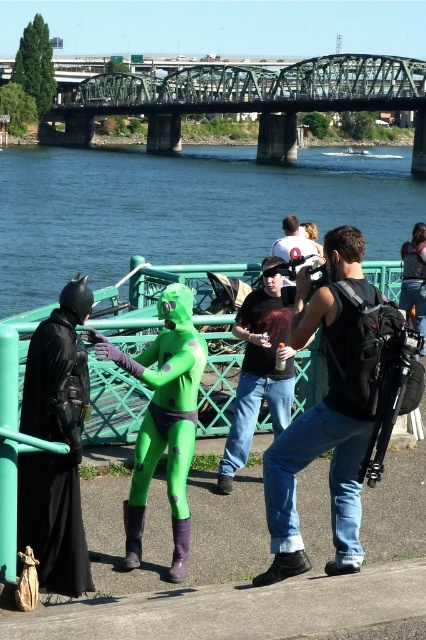
Question: Which object is closer to the camera taking this photo?

Choices:
 (A) white cotton t-shirt at center
 (B) matte black t-shirt at center

Answer: (A)

Question: Observing the image, what is the correct spatial positioning of green painted steel bridge at upper center in reference to black matte cape at left?

Choices:
 (A) above
 (B) below

Answer: (A)

Question: Among these objects, which one is nearest to the camera?

Choices:
 (A) green spandex suit at center
 (B) blue water at center

Answer: (A)

Question: Does denim jeans at center appear under black matte cape at left?

Choices:
 (A) yes
 (B) no

Answer: (B)

Question: Is denim jeans at center to the left of black matte cape at left from the viewer's perspective?

Choices:
 (A) yes
 (B) no

Answer: (B)

Question: Estimate the real-world distances between objects in this image. Which object is farther from the matte black t-shirt at center?

Choices:
 (A) black matte cape at left
 (B) green spandex suit at center

Answer: (A)